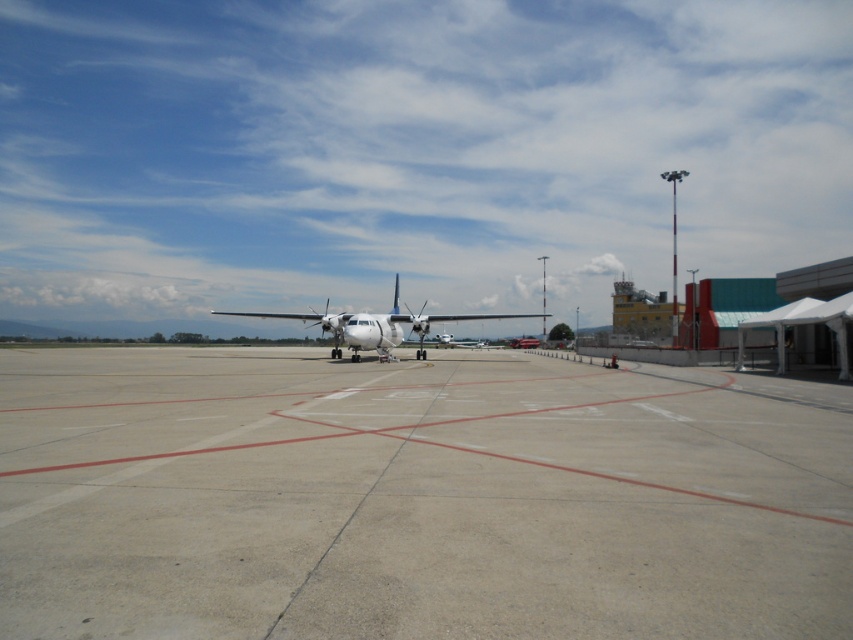
Question: Which of the following is the closest to the observer?

Choices:
 (A) (235, 314)
 (B) (833, 467)

Answer: (B)

Question: Is the position of gray concrete tarmac at center more distant than that of white matte airplane at center?

Choices:
 (A) no
 (B) yes

Answer: (A)

Question: Is gray concrete tarmac at center below white matte airplane at center?

Choices:
 (A) no
 (B) yes

Answer: (B)

Question: From the image, what is the correct spatial relationship of gray concrete tarmac at center in relation to white matte airplane at center?

Choices:
 (A) left
 (B) right

Answer: (B)